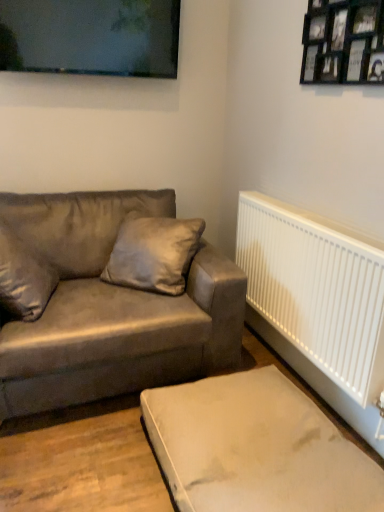
Question: Considering the relative sizes of suede-like beige pillow at center and black wooden picture frame at upper right, the second picture frame when ordered from left to right, in the image provided, is suede-like beige pillow at center shorter than black wooden picture frame at upper right, the second picture frame when ordered from left to right,?

Choices:
 (A) no
 (B) yes

Answer: (A)

Question: Is suede-like beige pillow at center smaller than black wooden picture frame at upper right, the second picture frame when ordered from left to right?

Choices:
 (A) no
 (B) yes

Answer: (A)

Question: Could you tell me if suede-like beige pillow at center is turned towards black wooden picture frame at upper right, which appears as the 1th picture frame when viewed from the front?

Choices:
 (A) yes
 (B) no

Answer: (B)

Question: Is suede-like beige pillow at center positioned with its back to black wooden picture frame at upper right, positioned as the 2th picture frame in back-to-front order?

Choices:
 (A) yes
 (B) no

Answer: (B)

Question: Is suede-like beige pillow at center bigger than black wooden picture frame at upper right, the second picture frame when ordered from left to right?

Choices:
 (A) yes
 (B) no

Answer: (A)

Question: Is black wooden picture frame at upper right, which appears as the 1th picture frame when viewed from the front, taller or shorter than beige fabric ottoman at lower right?

Choices:
 (A) short
 (B) tall

Answer: (B)

Question: From the image's perspective, is black wooden picture frame at upper right, the second picture frame when ordered from left to right, above or below beige fabric ottoman at lower right?

Choices:
 (A) above
 (B) below

Answer: (A)

Question: Based on their sizes in the image, would you say black wooden picture frame at upper right, the second picture frame when ordered from left to right, is bigger or smaller than beige fabric ottoman at lower right?

Choices:
 (A) small
 (B) big

Answer: (A)

Question: Considering the positions of point (380, 41) and point (301, 440), is point (380, 41) closer or farther from the camera than point (301, 440)?

Choices:
 (A) closer
 (B) farther

Answer: (A)

Question: In terms of size, does black wooden picture frame at upper right, the second picture frame when ordered from left to right, appear bigger or smaller than suede-like beige pillow at center?

Choices:
 (A) small
 (B) big

Answer: (A)

Question: Is point click(317, 1) positioned closer to the camera than point click(157, 219)?

Choices:
 (A) farther
 (B) closer

Answer: (B)

Question: Is black wooden picture frame at upper right, positioned as the 2th picture frame in back-to-front order, spatially inside suede-like beige pillow at center, or outside of it?

Choices:
 (A) outside
 (B) inside

Answer: (A)

Question: From a real-world perspective, relative to suede-like beige pillow at center, is black wooden picture frame at upper right, positioned as the 2th picture frame in back-to-front order, vertically above or below?

Choices:
 (A) below
 (B) above

Answer: (B)

Question: Is point (157, 53) positioned closer to the camera than point (365, 460)?

Choices:
 (A) closer
 (B) farther

Answer: (B)

Question: In the image, is matte black picture frame at upper center, the 1th picture frame when ordered from left to right, positioned in front of or behind beige fabric ottoman at lower right?

Choices:
 (A) behind
 (B) front

Answer: (A)